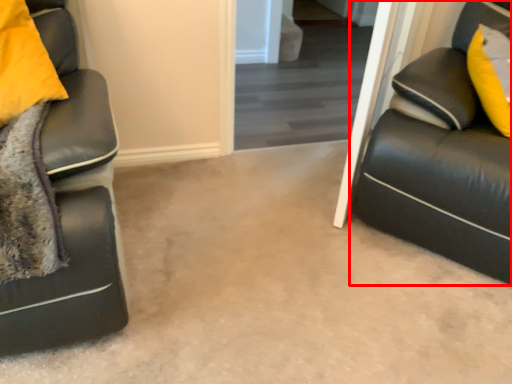
Question: From the image's perspective, what is the correct spatial relationship of studio couch (annotated by the red box) in relation to glass door?

Choices:
 (A) below
 (B) above

Answer: (A)